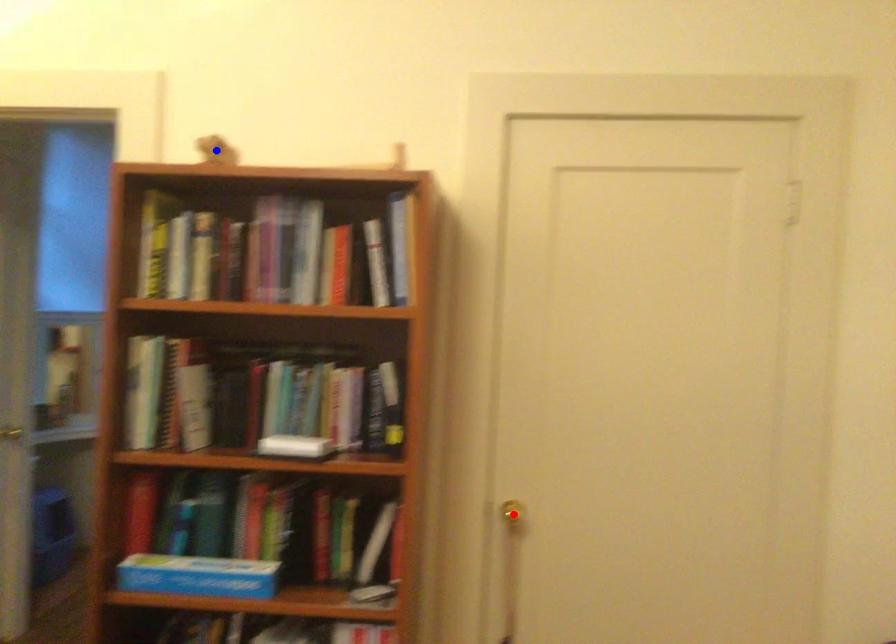
Question: Which of the two points in the image is closer to the camera?

Choices:
 (A) Blue point is closer.
 (B) Red point is closer.

Answer: (A)